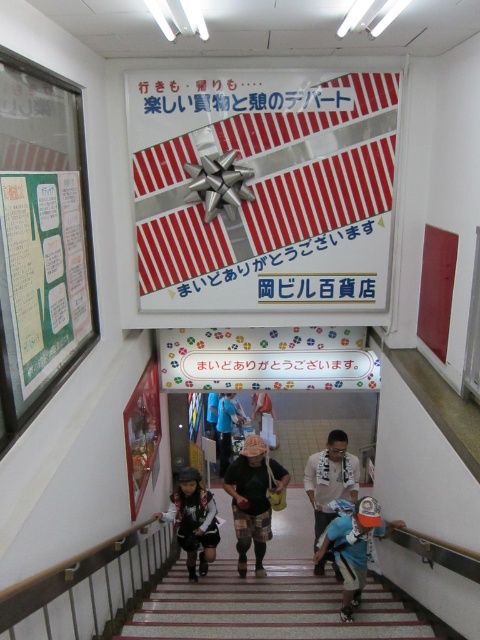
Does green paper at left have a smaller size compared to blue fabric cap at center?

Indeed, green paper at left has a smaller size compared to blue fabric cap at center.

Measure the distance between point [71,349] and camera.

They are 3.05 meters apart.

Who is more forward, (84, 284) or (229, 424)?

Point (84, 284) is in front.

At what (x,y) coordinates should I click in order to perform the action: click on green paper at left. Please return your answer as a coordinate pair (x, y). Looking at the image, I should click on (45, 269).

Between camouflage pants at center and matte black helmet at lower center, which one has more height?

With more height is camouflage pants at center.

This screenshot has height=640, width=480. What do you see at coordinates (252, 499) in the screenshot?
I see `camouflage pants at center` at bounding box center [252, 499].

Locate an element on the screen. This screenshot has height=640, width=480. camouflage pants at center is located at coordinates (252, 499).

The height and width of the screenshot is (640, 480). What are the coordinates of `blue denim jacket at lower center` in the screenshot? It's located at (354, 547).

Does blue denim jacket at lower center appear under matte black helmet at lower center?

No, blue denim jacket at lower center is not below matte black helmet at lower center.

You are a GUI agent. You are given a task and a screenshot of the screen. Output one action in this format:
    pyautogui.click(x=<x>, y=<y>)
    Task: Click on the blue denim jacket at lower center
    The width and height of the screenshot is (480, 640).
    Given the screenshot: What is the action you would take?
    pyautogui.click(x=354, y=547)

This screenshot has height=640, width=480. Identify the location of blue denim jacket at lower center. (354, 547).